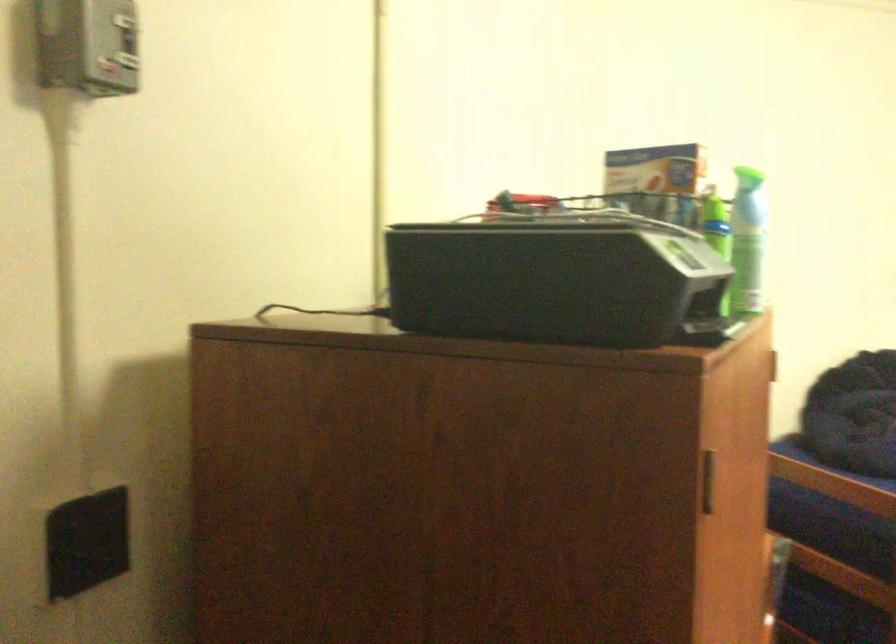
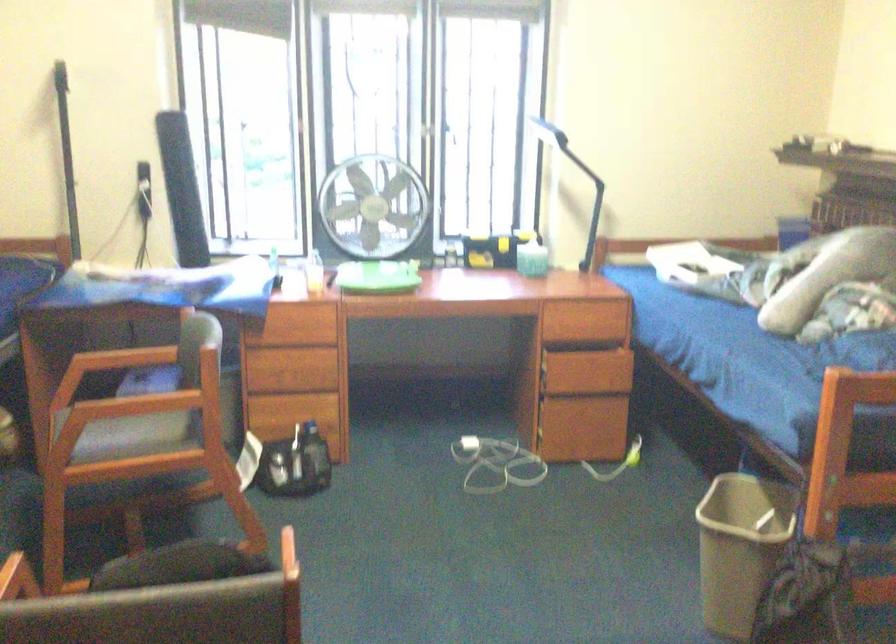
Question: The first image is from the beginning of the video and the second image is from the end. How did the camera likely rotate when shooting the video?

Choices:
 (A) Left
 (B) Right
 (C) Up
 (D) Down

Answer: (B)